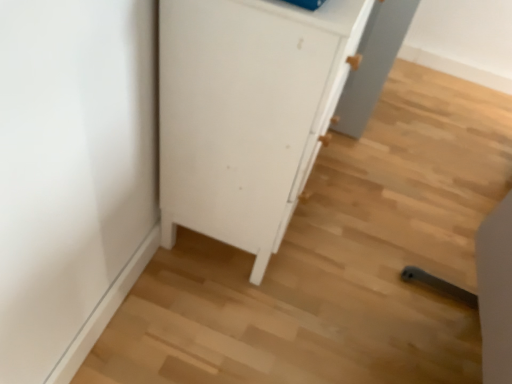
Image resolution: width=512 pixels, height=384 pixels. I want to click on vacant space to the left of light wood chair at lower right, so click(x=309, y=317).